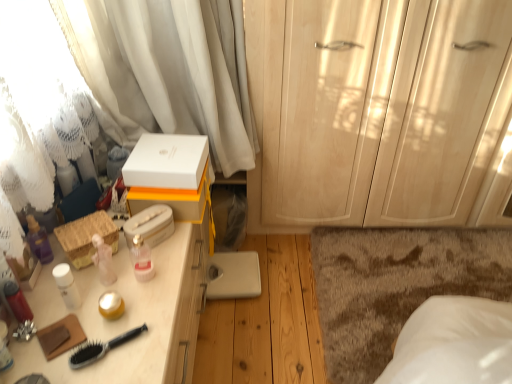
Identify the location of vacant area that lies between pink glossy bottle at center, the 1th toiletry in the back-to-front sequence, and black plastic brush at lower left. The image size is (512, 384). [x=124, y=303].